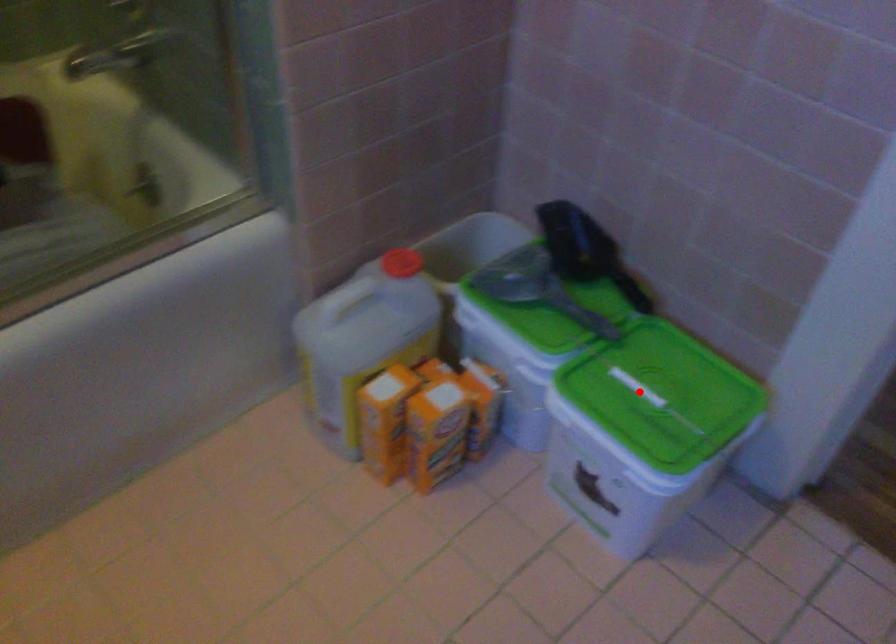
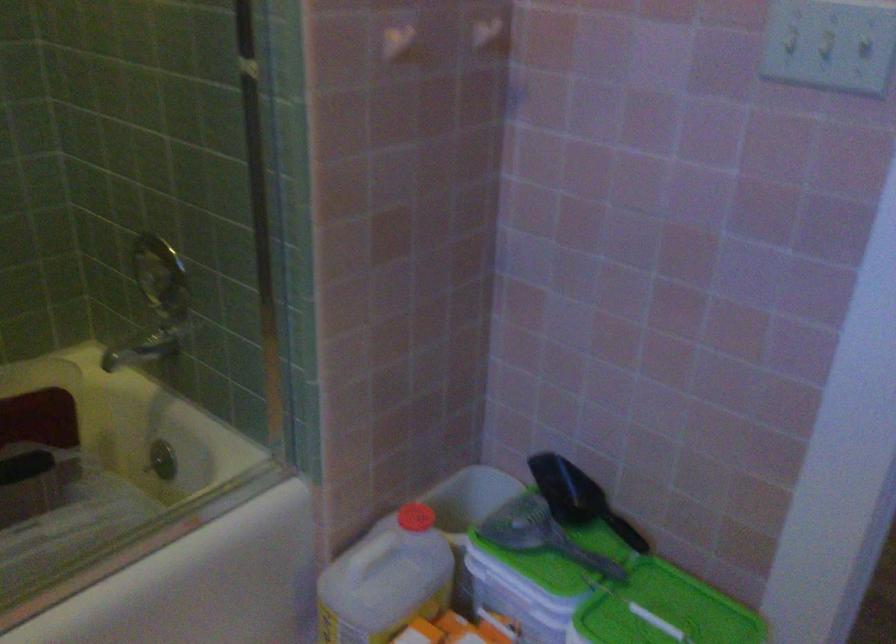
Question: I am providing you with two images of the same scene from different viewpoints. In image1, a red point is highlighted. Considering the same 3D point in image2, which of the following is correct?

Choices:
 (A) It is closer
 (B) It is farther

Answer: (B)